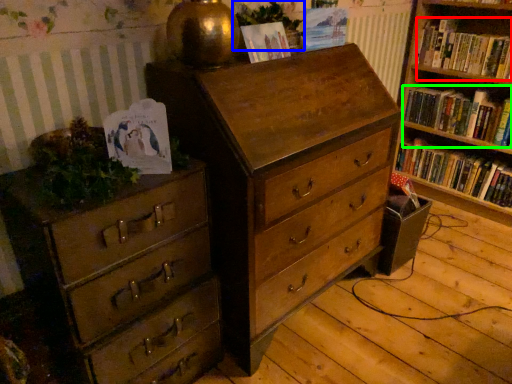
Question: Which object is the farthest from book (highlighted by a red box)? Choose among these: plant (highlighted by a blue box) or book (highlighted by a green box).

Choices:
 (A) plant
 (B) book

Answer: (A)